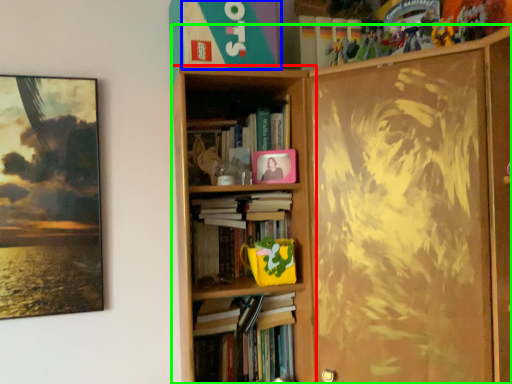
Question: Which object is the farthest from bookcase (highlighted by a red box)? Choose among these: paperback book (highlighted by a blue box) or bookcase (highlighted by a green box).

Choices:
 (A) paperback book
 (B) bookcase

Answer: (A)